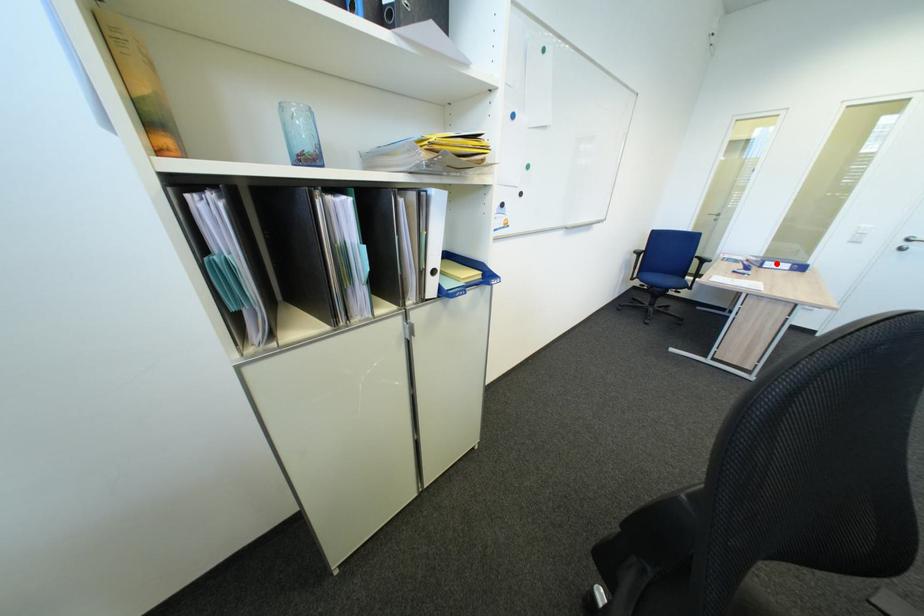
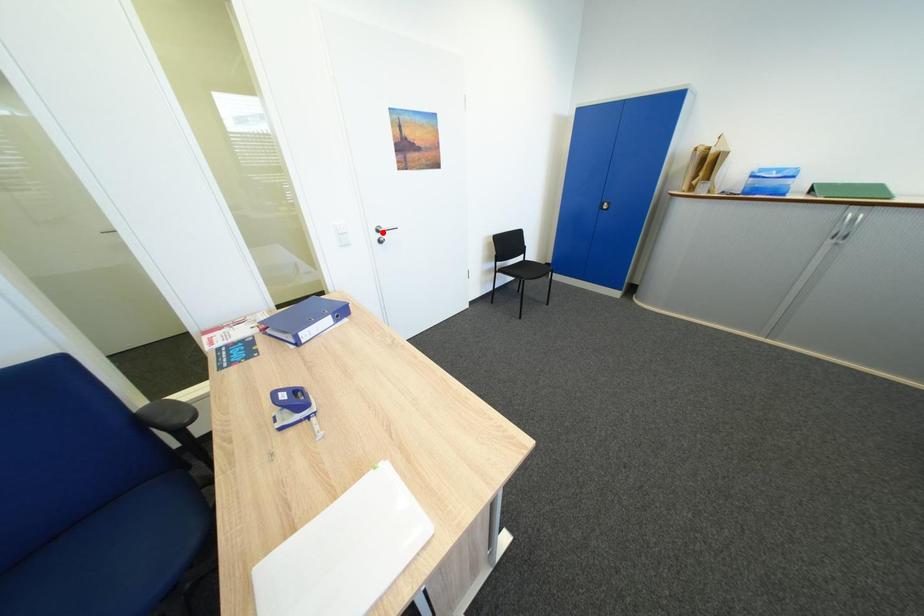
I am providing you with two images of the same scene from different viewpoints. A red point is marked on the first image and another point is marked on the second image. Do the highlighted points in image1 and image2 indicate the same real-world spot?

No